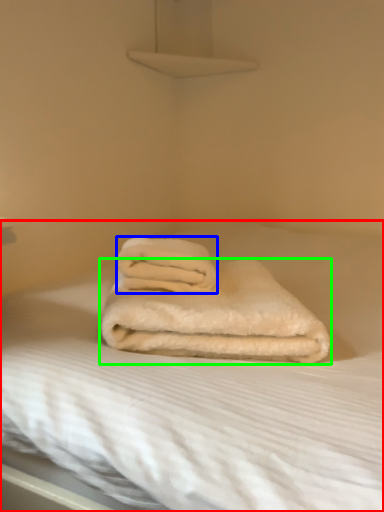
Question: Estimate the real-world distances between objects in this image. Which object is closer to bed (highlighted by a red box), towel (highlighted by a blue box) or towel (highlighted by a green box)?

Choices:
 (A) towel
 (B) towel

Answer: (B)